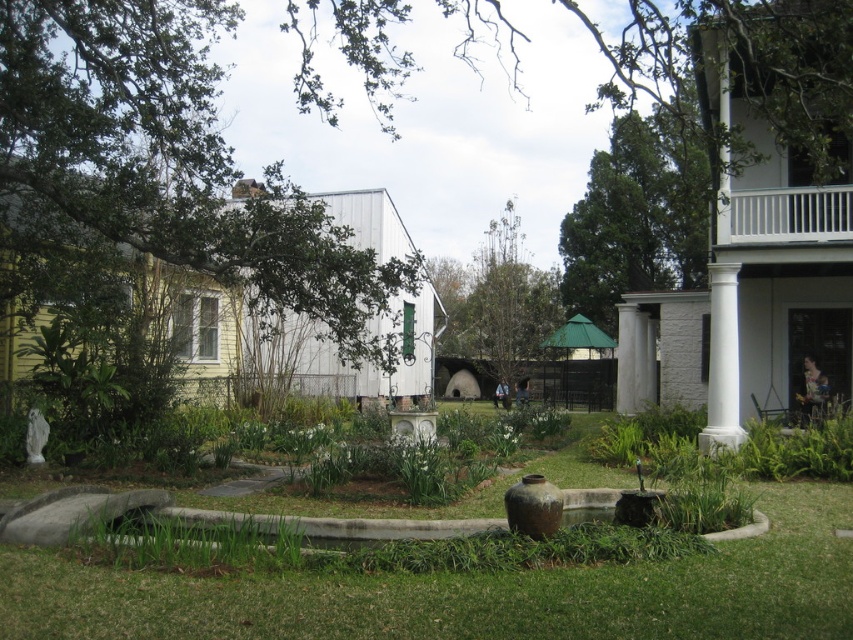
You are standing at the center of the garden and want to find the white wooden porch at upper right. Based on the coordinates provided, in which general direction should you look to see it?

The white wooden porch at upper right is located at coordinates point (x=787, y=216), which is in the upper right direction from your current position at the garden center.

You are a delivery person holding a package that requires a clear path to the white wooden porch at upper right. There is a white smooth column at right nearby. Can you safely navigate to the porch without bumping into the column?

The white wooden porch at upper right is 4.35 feet away from the white smooth column at right. Since the distance between them is sufficient, you can safely navigate to the porch without bumping into the column.

You are planning to place a new bench in the garden. The bench is 1.5 meters wide. You want to place it either on the white wooden porch at upper right or next to the white smooth column at right. Which location has enough space for the bench?

The white wooden porch at upper right has a greater width than the white smooth column at right, so the bench can be placed on the white wooden porch at upper right since it has enough space.